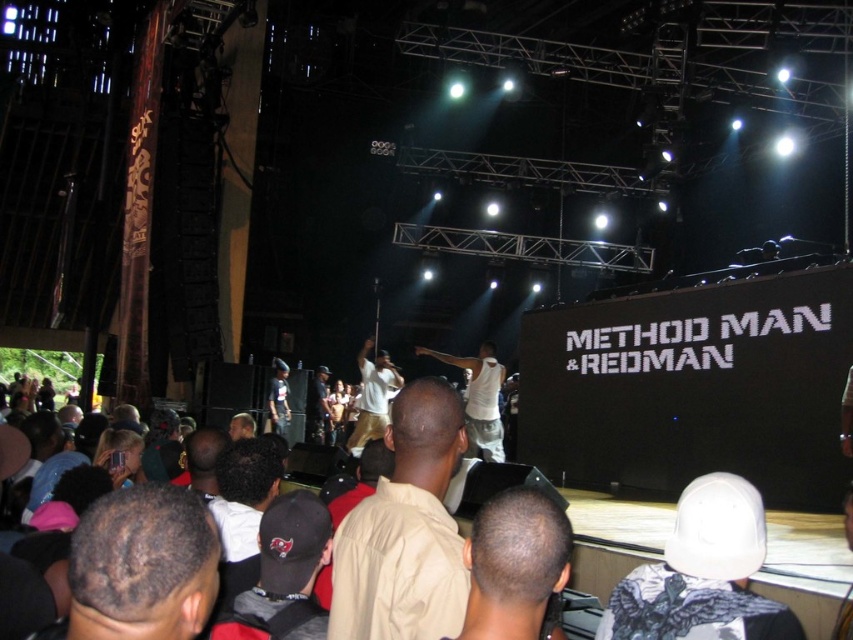
Question: Which of the following is the closest to the observer?

Choices:
 (A) coord(276,387)
 (B) coord(738,500)
 (C) coord(473,456)
 (D) coord(303,564)

Answer: (B)

Question: Does white matte baseball cap at lower right have a smaller size compared to white cotton tank top at center?

Choices:
 (A) yes
 (B) no

Answer: (A)

Question: Which object is farther from the camera taking this photo?

Choices:
 (A) dark brown hair at lower left
 (B) black fabric cap at center

Answer: (B)

Question: Which object is positioned farthest from the dark brown hair at center?

Choices:
 (A) dark gray fabric jacket at center
 (B) dark brown hair at lower left

Answer: (A)

Question: Does dark brown hair at lower left have a larger size compared to black fabric cap at center?

Choices:
 (A) no
 (B) yes

Answer: (A)

Question: Is tan cotton shirt at center above denim jeans at center?

Choices:
 (A) no
 (B) yes

Answer: (B)